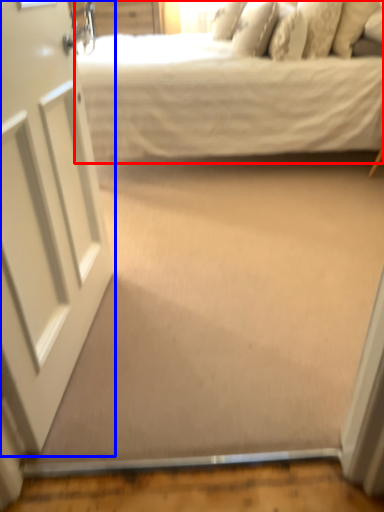
Question: Which point is further to the camera, bed (highlighted by a red box) or door (highlighted by a blue box)?

Choices:
 (A) bed
 (B) door

Answer: (A)